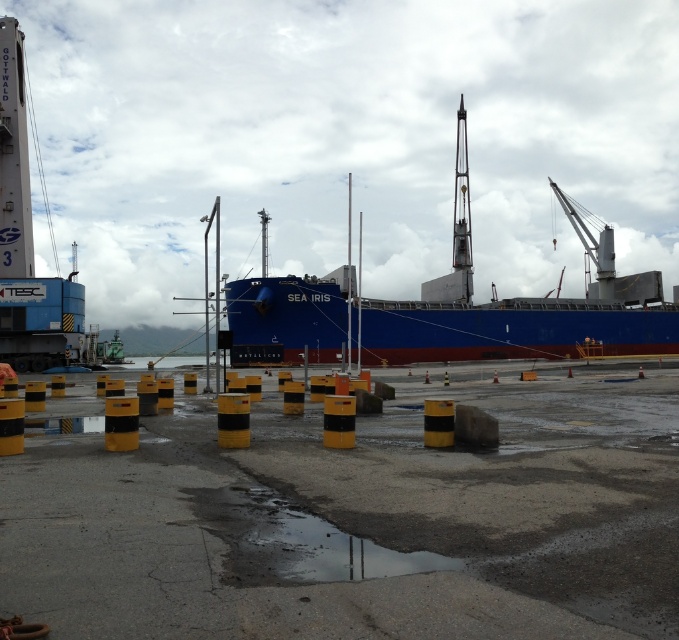
Does yellow/black striped barrels at center have a greater width compared to blue matte ship at center?

No.

Who is higher up, yellow/black striped barrels at center or blue matte ship at center?

blue matte ship at center

Where is `yellow/black striped barrels at center`? The width and height of the screenshot is (679, 640). yellow/black striped barrels at center is located at coordinates [359, 516].

Locate an element on the screen. yellow/black striped barrels at center is located at coordinates (359, 516).